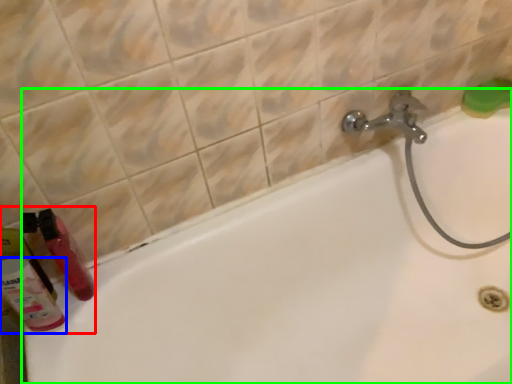
Question: Which is nearer to the toiletry (highlighted by a red box)? cleaning product (highlighted by a blue box) or bathtub (highlighted by a green box).

Choices:
 (A) cleaning product
 (B) bathtub

Answer: (A)